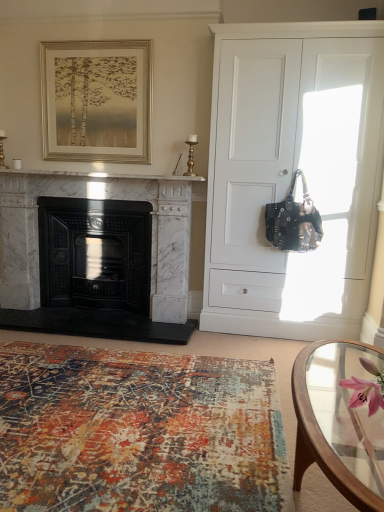
The height and width of the screenshot is (512, 384). Describe the element at coordinates (138, 432) in the screenshot. I see `textured rug at lower left` at that location.

The width and height of the screenshot is (384, 512). Find the location of `black cast iron fireplace at left, which is the 1th fireplace in left-to-right order`. black cast iron fireplace at left, which is the 1th fireplace in left-to-right order is located at coordinates (95, 253).

Describe the element at coordinates (366, 388) in the screenshot. I see `pink silk flower at lower right` at that location.

Locate an element on the screen. white marble fireplace at left, the second fireplace positioned from the left is located at coordinates (98, 199).

Between white matte cabinet at right and black cast iron fireplace at left, which is counted as the 2th fireplace, starting from the right, which one has larger width?

With larger width is white matte cabinet at right.

From the image's perspective, between white matte cabinet at right and black cast iron fireplace at left, which is the 1th fireplace in left-to-right order, which one is located above?

white matte cabinet at right is shown above in the image.

Between white matte cabinet at right and black cast iron fireplace at left, which is counted as the 2th fireplace, starting from the right, which one has less height?

Standing shorter between the two is black cast iron fireplace at left, which is counted as the 2th fireplace, starting from the right.

Which is less distant, (366, 47) or (128, 295)?

Point (366, 47) is positioned closer to the camera compared to point (128, 295).

Is pink silk flower at lower right wider than textured rug at lower left?

Incorrect, the width of pink silk flower at lower right does not surpass that of textured rug at lower left.

Can you see pink silk flower at lower right touching textured rug at lower left?

No, pink silk flower at lower right is not in contact with textured rug at lower left.

Can we say pink silk flower at lower right lies outside textured rug at lower left?

Yes, pink silk flower at lower right is not within textured rug at lower left.

Is clear glass coffee table at lower right positioned before black leather handbag at right?

That is True.

Is clear glass coffee table at lower right facing towards black leather handbag at right?

No, clear glass coffee table at lower right is not oriented towards black leather handbag at right.

Is clear glass coffee table at lower right far away from black leather handbag at right?

Yes.

Who is smaller, white matte cabinet at right or white marble fireplace at left, the second fireplace positioned from the left?

white marble fireplace at left, the second fireplace positioned from the left.

Is the position of white matte cabinet at right more distant than that of white marble fireplace at left, the first fireplace in the right-to-left sequence?

No, it is in front of white marble fireplace at left, the first fireplace in the right-to-left sequence.

Do you think white matte cabinet at right is within white marble fireplace at left, the first fireplace in the right-to-left sequence, or outside of it?

white matte cabinet at right lies outside white marble fireplace at left, the first fireplace in the right-to-left sequence.

The height and width of the screenshot is (512, 384). In order to click on the 1st fireplace behind the white matte cabinet at right in this screenshot , I will do `click(98, 199)`.

From a real-world perspective, is white marble fireplace at left, the second fireplace positioned from the left, above or below black cast iron fireplace at left, which is the 1th fireplace in left-to-right order?

white marble fireplace at left, the second fireplace positioned from the left, is situated higher than black cast iron fireplace at left, which is the 1th fireplace in left-to-right order, in the real world.

Considering their positions, is white marble fireplace at left, the first fireplace in the right-to-left sequence, located in front of or behind black cast iron fireplace at left, which is counted as the 2th fireplace, starting from the right?

white marble fireplace at left, the first fireplace in the right-to-left sequence, is in front of black cast iron fireplace at left, which is counted as the 2th fireplace, starting from the right.

In the scene shown: Measure the distance from white marble fireplace at left, the second fireplace positioned from the left, to black cast iron fireplace at left, which is counted as the 2th fireplace, starting from the right.

The distance of white marble fireplace at left, the second fireplace positioned from the left, from black cast iron fireplace at left, which is counted as the 2th fireplace, starting from the right, is 9.03 inches.

Is white matte cabinet at right closer to camera compared to gold-toned wooden frame at upper center?

Yes, white matte cabinet at right is in front of gold-toned wooden frame at upper center.

The height and width of the screenshot is (512, 384). Identify the location of picture frame above the white matte cabinet at right (from the image's perspective). (96, 100).

Is white matte cabinet at right outside of gold-toned wooden frame at upper center?

white matte cabinet at right lies outside gold-toned wooden frame at upper center's area.

From a real-world perspective, is white matte cabinet at right under gold-toned wooden frame at upper center?

Yes, from a real-world perspective, white matte cabinet at right is under gold-toned wooden frame at upper center.

In the image, there is a pink silk flower at lower right. In order to click on coffee table below it (from the image's perspective) in this screenshot , I will do `click(339, 422)`.

Is pink silk flower at lower right not near clear glass coffee table at lower right?

No, pink silk flower at lower right is not far away from clear glass coffee table at lower right.

From a real-world perspective, is pink silk flower at lower right positioned under clear glass coffee table at lower right based on gravity?

No.

From the image's perspective, relative to clear glass coffee table at lower right, is pink silk flower at lower right above or below?

From the image's perspective, pink silk flower at lower right appears above clear glass coffee table at lower right.

Locate an element on the screen. Image resolution: width=384 pixels, height=512 pixels. the 2nd fireplace to the left of the white matte cabinet at right, counting from the anchor's position is located at coordinates (95, 253).

This screenshot has height=512, width=384. Identify the location of flower above the textured rug at lower left (from the image's perspective). (366, 388).

Estimate the real-world distances between objects in this image. Which object is closer to white marble fireplace at left, the second fireplace positioned from the left, white matte cabinet at right or pink silk flower at lower right?

white matte cabinet at right is positioned closer to the anchor white marble fireplace at left, the second fireplace positioned from the left.

Based on their spatial positions, is white marble fireplace at left, the first fireplace in the right-to-left sequence, or white matte cabinet at right closer to black cast iron fireplace at left, which is the 1th fireplace in left-to-right order?

white marble fireplace at left, the first fireplace in the right-to-left sequence, lies closer to black cast iron fireplace at left, which is the 1th fireplace in left-to-right order, than the other object.

Based on their spatial positions, is clear glass coffee table at lower right or gold-toned wooden frame at upper center closer to textured rug at lower left?

clear glass coffee table at lower right.

Based on the photo, looking at the image, which one is located further to white matte cabinet at right, textured rug at lower left or clear glass coffee table at lower right?

textured rug at lower left.

Based on their spatial positions, is textured rug at lower left or clear glass coffee table at lower right closer to gold-toned wooden frame at upper center?

Among the two, textured rug at lower left is located nearer to gold-toned wooden frame at upper center.

Considering their positions, is pink silk flower at lower right positioned closer to clear glass coffee table at lower right than gold-toned wooden frame at upper center?

pink silk flower at lower right is closer to clear glass coffee table at lower right.

Looking at the image, which one is located further to clear glass coffee table at lower right, gold-toned wooden frame at upper center or black cast iron fireplace at left, which is counted as the 2th fireplace, starting from the right?

gold-toned wooden frame at upper center lies further to clear glass coffee table at lower right than the other object.

Looking at the image, which one is located further to white marble fireplace at left, the second fireplace positioned from the left, textured rug at lower left or clear glass coffee table at lower right?

The object further to white marble fireplace at left, the second fireplace positioned from the left, is clear glass coffee table at lower right.

Image resolution: width=384 pixels, height=512 pixels. I want to click on cabinetry between black cast iron fireplace at left, which is the 1th fireplace in left-to-right order, and black leather handbag at right, so click(x=291, y=175).

The height and width of the screenshot is (512, 384). Find the location of `cabinetry located between clear glass coffee table at lower right and gold-toned wooden frame at upper center in the depth direction`. cabinetry located between clear glass coffee table at lower right and gold-toned wooden frame at upper center in the depth direction is located at coordinates (291, 175).

At what (x,y) coordinates should I click in order to perform the action: click on cabinetry located between clear glass coffee table at lower right and black cast iron fireplace at left, which is the 1th fireplace in left-to-right order, in the depth direction. Please return your answer as a coordinate pair (x, y). The image size is (384, 512). Looking at the image, I should click on (291, 175).

You are a GUI agent. You are given a task and a screenshot of the screen. Output one action in this format:
    pyautogui.click(x=<x>, y=<y>)
    Task: Click on the cabinetry positioned between textured rug at lower left and black cast iron fireplace at left, which is the 1th fireplace in left-to-right order, from near to far
    Image resolution: width=384 pixels, height=512 pixels.
    Given the screenshot: What is the action you would take?
    pyautogui.click(x=291, y=175)